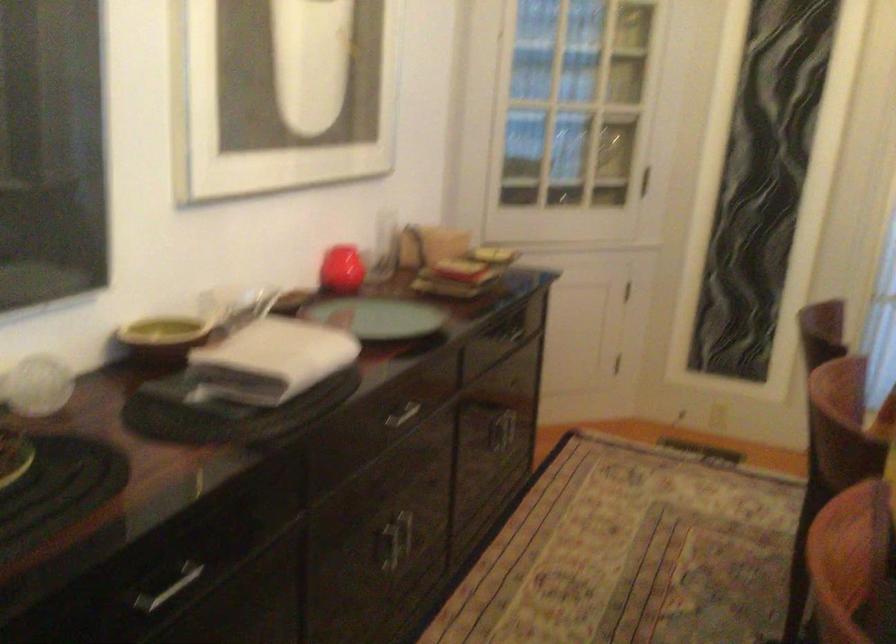
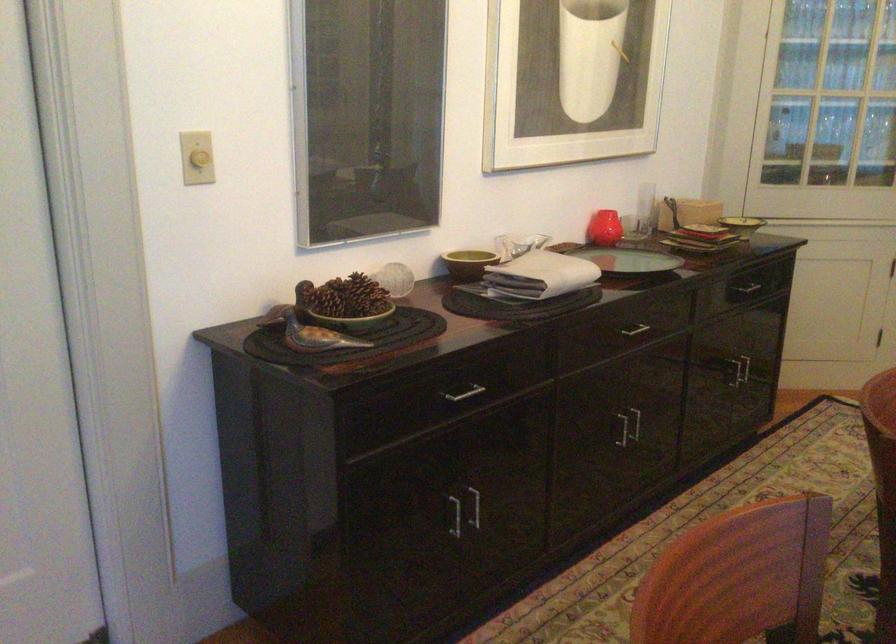
Where in the second image is the point corresponding to [337,269] from the first image?

(604, 228)